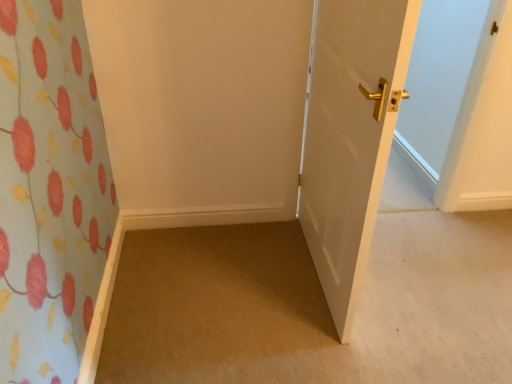
At what (x,y) coordinates should I click in order to perform the action: click on free space in front of white glossy door at right. Please return your answer as a coordinate pair (x, y). Looking at the image, I should click on (328, 332).